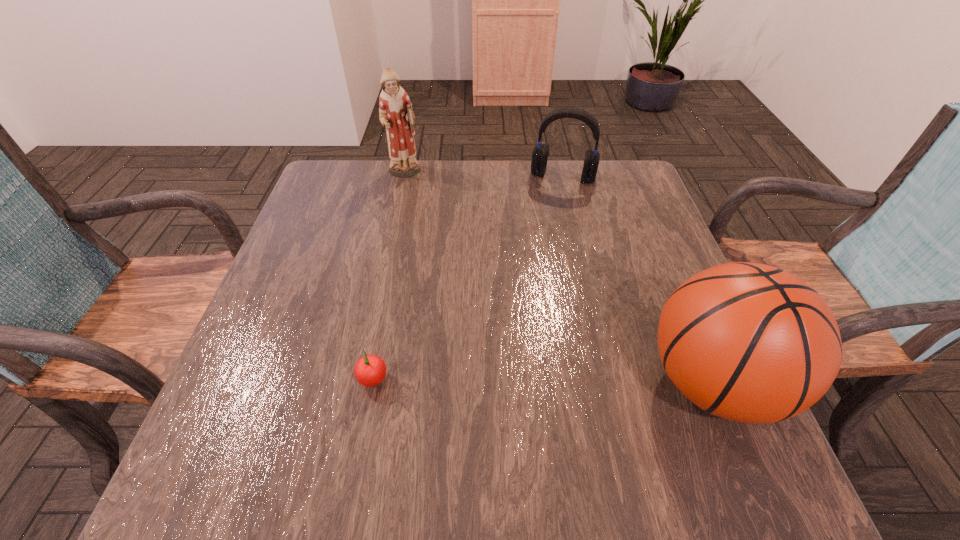
You are a GUI agent. You are given a task and a screenshot of the screen. Output one action in this format:
    pyautogui.click(x=<x>, y=<y>)
    Task: Click on the vacant space at the far edge
    
    Given the screenshot: What is the action you would take?
    386,177

At what (x,y) coordinates should I click in order to perform the action: click on vacant space at the left edge of the desktop. Please return your answer as a coordinate pair (x, y). Image resolution: width=960 pixels, height=540 pixels. Looking at the image, I should click on (303, 219).

Where is `free space at the right edge`? This screenshot has width=960, height=540. free space at the right edge is located at coordinates (619, 234).

Find the location of a particular element. free space at the far left corner of the desktop is located at coordinates (335, 199).

Image resolution: width=960 pixels, height=540 pixels. What are the coordinates of `vacant space at the near left corner` in the screenshot? It's located at (262, 408).

At what (x,y) coordinates should I click in order to perform the action: click on free region at the far right corner of the desktop. Please return your answer as a coordinate pair (x, y). The height and width of the screenshot is (540, 960). Looking at the image, I should click on (620, 182).

Identify the location of vacant area that lies between the figurine and the shortest object. (389, 278).

The height and width of the screenshot is (540, 960). I want to click on vacant region between the second shortest object and the shortest object, so click(x=468, y=280).

The image size is (960, 540). Identify the location of vacant area that lies between the basketball and the second shortest object. (637, 280).

Image resolution: width=960 pixels, height=540 pixels. Find the location of `vacant point located between the basketball and the cherry`. vacant point located between the basketball and the cherry is located at coordinates (542, 383).